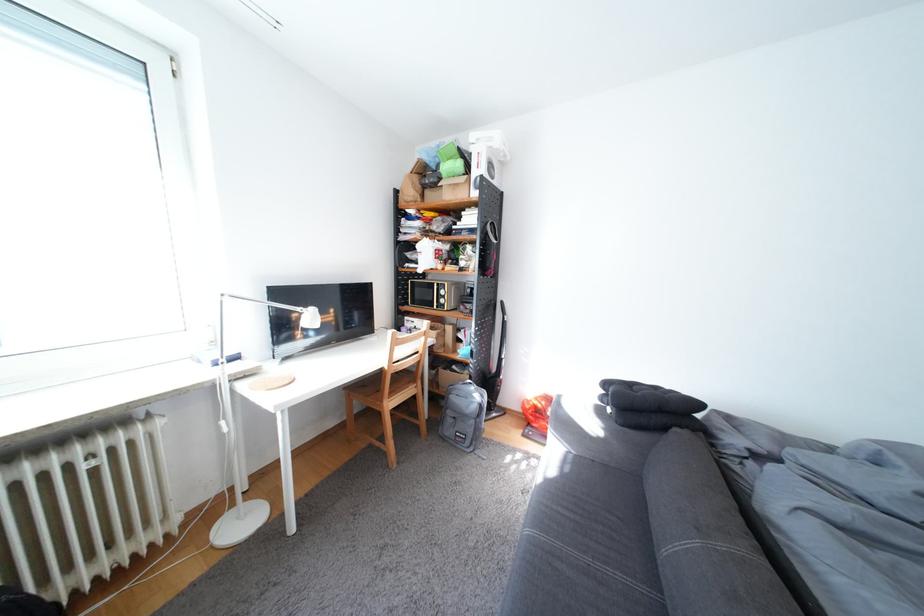
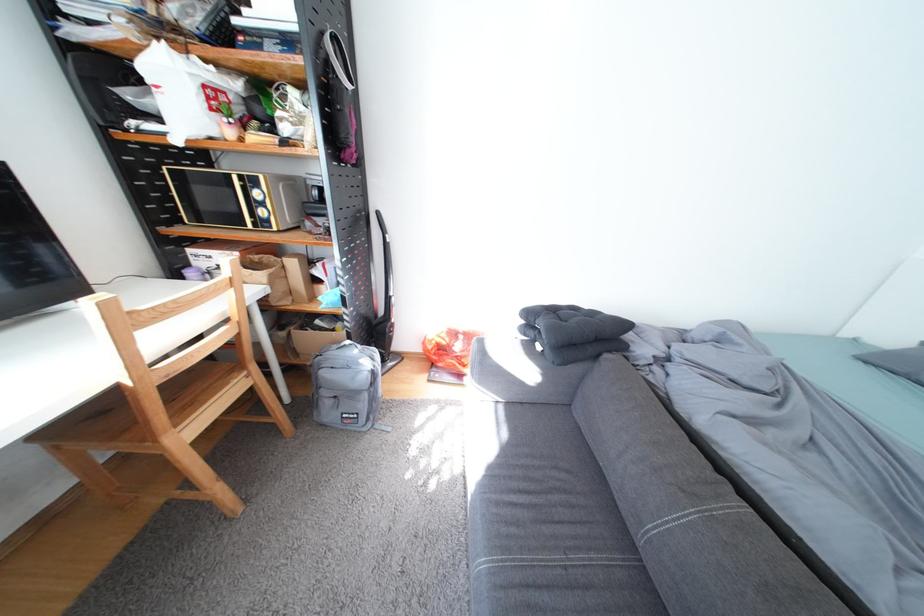
The point at (494, 397) is marked in the first image. Where is the corresponding point in the second image?

(385, 360)